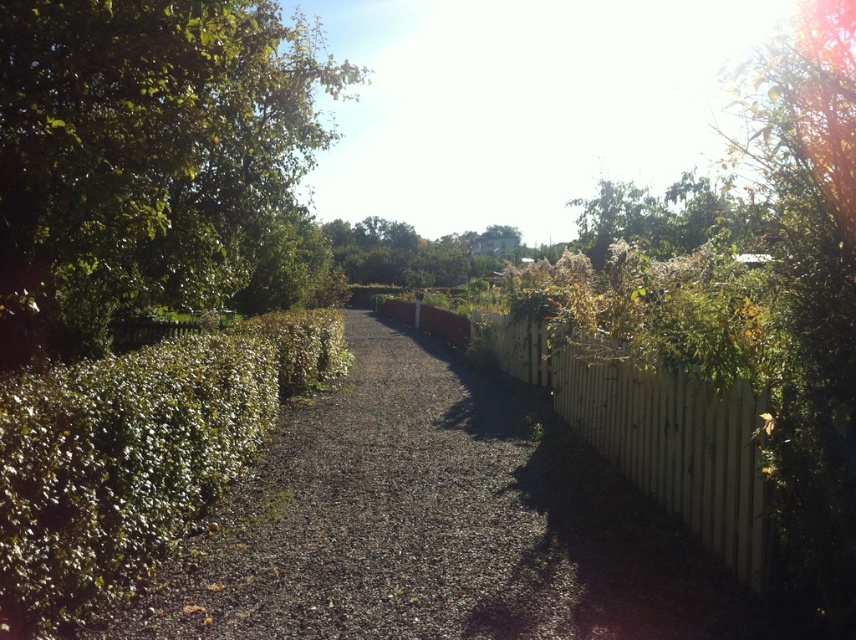
Does green leafy hedge at left have a smaller size compared to white wooden fence at center-right?

No.

Does green leafy hedge at left come in front of white wooden fence at center-right?

Yes, it is in front of white wooden fence at center-right.

Is point (72, 516) positioned in front of point (515, 369)?

Yes, point (72, 516) is in front of point (515, 369).

Locate an element on the screen. The height and width of the screenshot is (640, 856). green leafy hedge at left is located at coordinates (135, 452).

Does dark gray gravel at center have a smaller size compared to green leafy bush at left?

Correct, dark gray gravel at center occupies less space than green leafy bush at left.

Does dark gray gravel at center have a lesser height compared to green leafy bush at left?

Indeed, dark gray gravel at center has a lesser height compared to green leafy bush at left.

Between point (147, 612) and point (10, 54), which one is positioned behind?

Positioned behind is point (10, 54).

What are the coordinates of `dark gray gravel at center` in the screenshot? It's located at (434, 524).

Does green leafy bush at left appear on the right side of green leafy hedge at left?

Incorrect, green leafy bush at left is not on the right side of green leafy hedge at left.

You are a GUI agent. You are given a task and a screenshot of the screen. Output one action in this format:
    pyautogui.click(x=<x>, y=<y>)
    Task: Click on the green leafy bush at left
    Image resolution: width=856 pixels, height=640 pixels.
    Given the screenshot: What is the action you would take?
    click(x=143, y=154)

Does point (15, 125) lie behind point (343, 365)?

No.

At what (x,y) coordinates should I click in order to perform the action: click on green leafy bush at left. Please return your answer as a coordinate pair (x, y). This screenshot has height=640, width=856. Looking at the image, I should click on (143, 154).